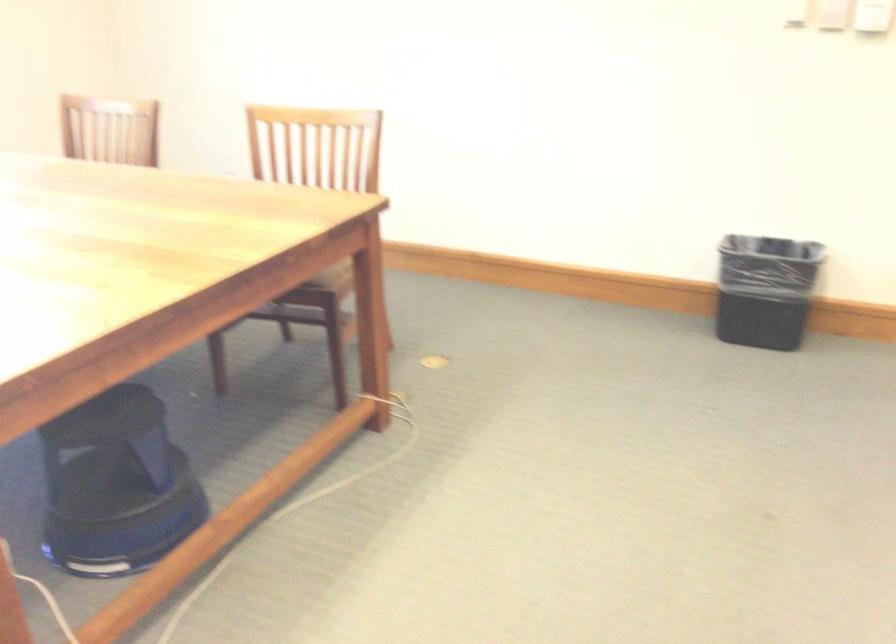
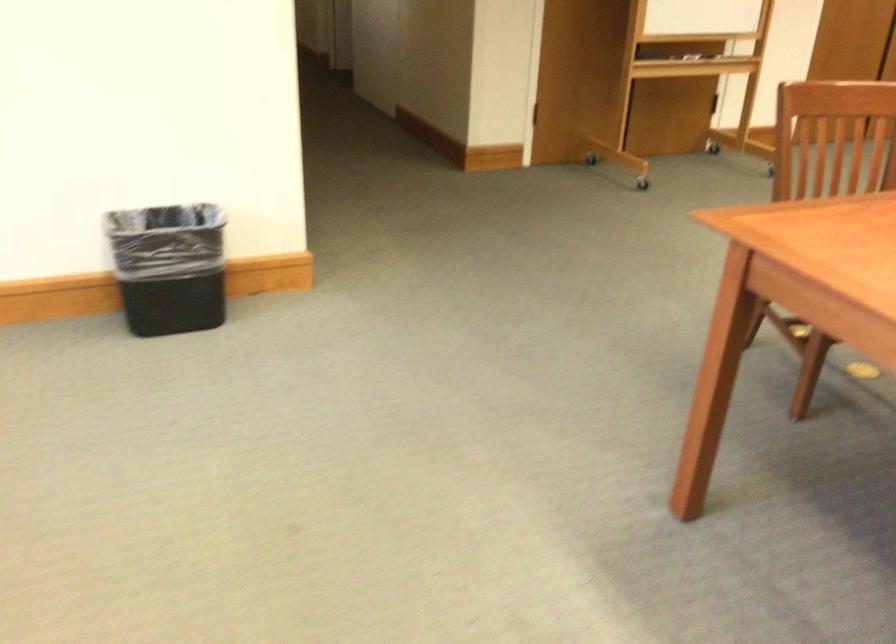
Find the pixel in the second image that matches (755,281) in the first image.

(168, 267)